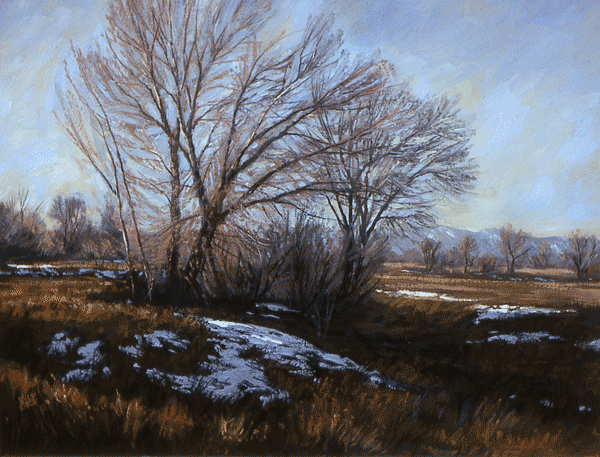
You are a GUI agent. You are given a task and a screenshot of the screen. Output one action in this format:
    pyautogui.click(x=<x>, y=<y>)
    Task: Click on the tan shadings
    Image resolution: width=600 pixels, height=457 pixels.
    Given the screenshot: What is the action you would take?
    pyautogui.click(x=500, y=172), pyautogui.click(x=477, y=98), pyautogui.click(x=45, y=70), pyautogui.click(x=73, y=177)